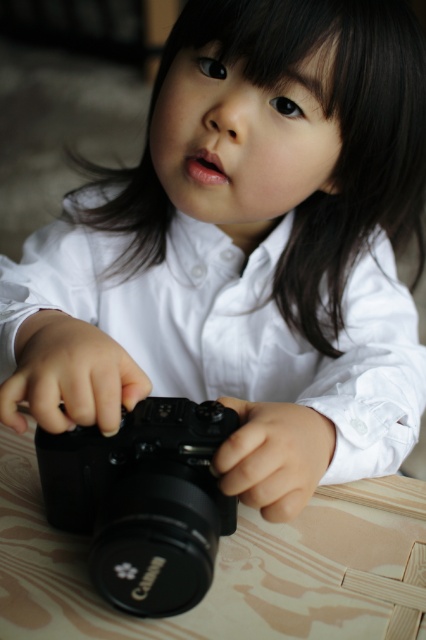
Is wooden table at center below black plastic camera at center?

Indeed, wooden table at center is positioned under black plastic camera at center.

Does wooden table at center have a lesser height compared to black plastic camera at center?

Yes, wooden table at center is shorter than black plastic camera at center.

Who is more distant from viewer, (354, 547) or (181, 586)?

Point (354, 547)

In order to click on wooden table at center in this screenshot , I will do `click(219, 566)`.